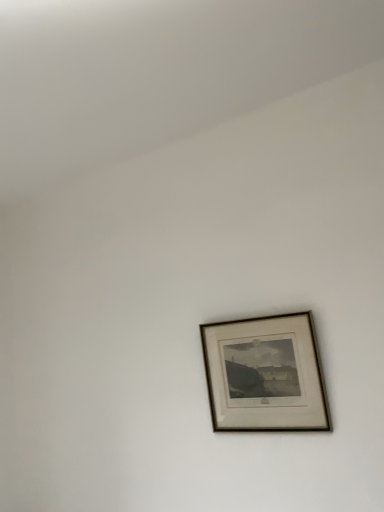
What do you see at coordinates (265, 375) in the screenshot? I see `wooden framed print at lower center` at bounding box center [265, 375].

In the scene shown: In order to face wooden framed print at lower center, should I rotate leftwards or rightwards?

Turn right by 9.079 degrees to look at wooden framed print at lower center.

The width and height of the screenshot is (384, 512). Identify the location of wooden framed print at lower center. (265, 375).

The height and width of the screenshot is (512, 384). Find the location of `wooden framed print at lower center`. wooden framed print at lower center is located at coordinates (265, 375).